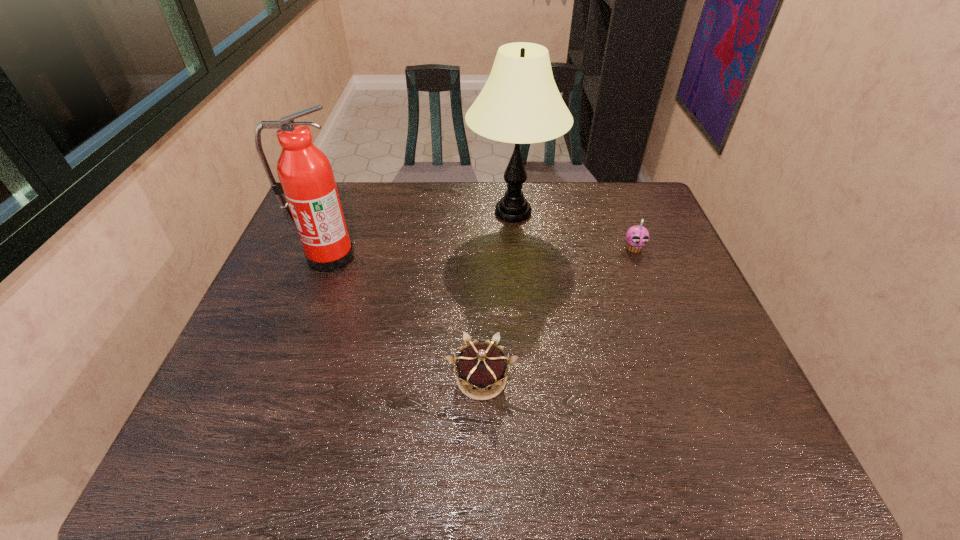
You are a GUI agent. You are given a task and a screenshot of the screen. Output one action in this format:
    pyautogui.click(x=<x>, y=<y>)
    Task: Click on the lamp
    This screenshot has height=540, width=960.
    Given the screenshot: What is the action you would take?
    pyautogui.click(x=520, y=103)

Locate an element on the screen. The width and height of the screenshot is (960, 540). the leftmost object is located at coordinates (313, 205).

Where is `cupcake`? cupcake is located at coordinates (637, 237).

Find the location of a particular element. the nearest object is located at coordinates (481, 367).

Find the location of `vacant space located 0.390m on the left of the lamp`. vacant space located 0.390m on the left of the lamp is located at coordinates (348, 213).

Locate an element on the screen. vacant space positioned on the label side of the leftmost object is located at coordinates (283, 376).

Locate an element on the screen. The width and height of the screenshot is (960, 540). free space located 0.170m on the face of the cupcake is located at coordinates (653, 298).

Where is `free space located 0.260m on the left of the crown`? The image size is (960, 540). free space located 0.260m on the left of the crown is located at coordinates (330, 379).

This screenshot has height=540, width=960. Identify the location of object situated at the far edge. (520, 103).

Find the location of `object that is at the left edge`. object that is at the left edge is located at coordinates (313, 205).